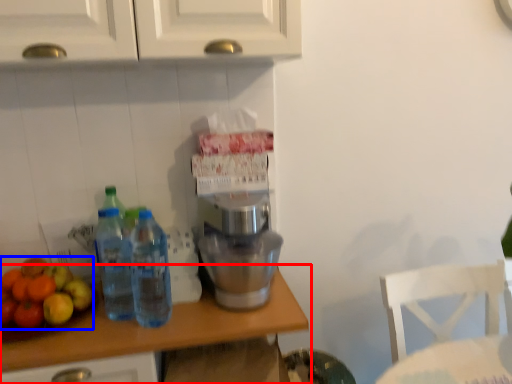
Question: Among these objects, which one is nearest to the camera, countertop (highlighted by a red box) or apple (highlighted by a blue box)?

Choices:
 (A) countertop
 (B) apple

Answer: (A)